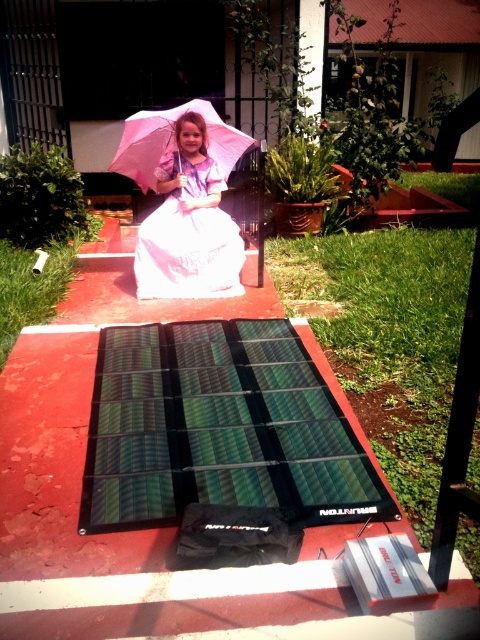
Which is above, green flexible solar panel at center or pink fabric umbrella at center?

Positioned higher is pink fabric umbrella at center.

Can you confirm if green flexible solar panel at center is positioned to the left of pink fabric umbrella at center?

Incorrect, green flexible solar panel at center is not on the left side of pink fabric umbrella at center.

Where is `green flexible solar panel at center`? The width and height of the screenshot is (480, 640). green flexible solar panel at center is located at coordinates (219, 429).

Who is more forward, [127,417] or [180,205]?

Point [127,417] is more forward.

Is point (303, 465) farther from camera compared to point (164, 282)?

No, (303, 465) is closer to viewer.

The image size is (480, 640). Find the location of `green flexible solar panel at center`. green flexible solar panel at center is located at coordinates (219, 429).

The image size is (480, 640). What do you see at coordinates (189, 237) in the screenshot? I see `purple satin dress at center` at bounding box center [189, 237].

Is purple satin dress at center below pink fabric umbrella at center?

Yes, purple satin dress at center is below pink fabric umbrella at center.

What do you see at coordinates (189, 237) in the screenshot? The image size is (480, 640). I see `purple satin dress at center` at bounding box center [189, 237].

You are a GUI agent. You are given a task and a screenshot of the screen. Output one action in this format:
    pyautogui.click(x=<x>, y=<y>)
    Task: Click on the purple satin dress at center
    The height and width of the screenshot is (640, 480).
    Given the screenshot: What is the action you would take?
    pyautogui.click(x=189, y=237)